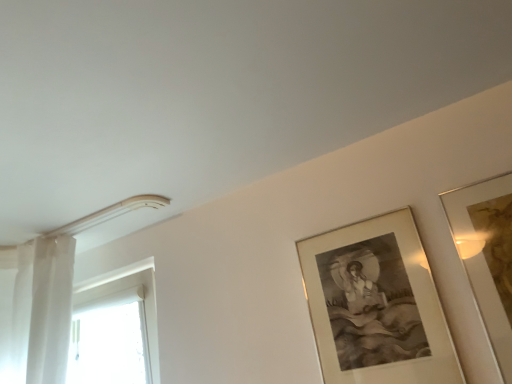
Question: Considering the relative sizes of gold metallic picture frame at upper right, which appears as the 2th picture frame when viewed from the left, and white glossy door at left in the image provided, is gold metallic picture frame at upper right, which appears as the 2th picture frame when viewed from the left, bigger than white glossy door at left?

Choices:
 (A) no
 (B) yes

Answer: (A)

Question: Is gold metallic picture frame at upper right, marked as the 1th picture frame in a right-to-left arrangement, oriented away from white glossy door at left?

Choices:
 (A) yes
 (B) no

Answer: (B)

Question: From a real-world perspective, is gold metallic picture frame at upper right, which appears as the 2th picture frame when viewed from the left, on top of white glossy door at left?

Choices:
 (A) yes
 (B) no

Answer: (B)

Question: Is gold metallic picture frame at upper right, which appears as the 2th picture frame when viewed from the left, wider than white glossy door at left?

Choices:
 (A) no
 (B) yes

Answer: (A)

Question: Considering the relative sizes of gold metallic picture frame at upper right, marked as the 1th picture frame in a right-to-left arrangement, and white glossy door at left in the image provided, is gold metallic picture frame at upper right, marked as the 1th picture frame in a right-to-left arrangement, smaller than white glossy door at left?

Choices:
 (A) yes
 (B) no

Answer: (A)

Question: Can you confirm if gold metallic picture frame at upper right, marked as the 1th picture frame in a right-to-left arrangement, is shorter than white glossy door at left?

Choices:
 (A) yes
 (B) no

Answer: (B)

Question: Can you confirm if gold-framed artwork at upper right, arranged as the 2th picture frame when viewed from the right, is shorter than gold metallic picture frame at upper right, marked as the 1th picture frame in a right-to-left arrangement?

Choices:
 (A) no
 (B) yes

Answer: (B)

Question: From a real-world perspective, does gold-framed artwork at upper right, arranged as the 2th picture frame when viewed from the right, sit lower than gold metallic picture frame at upper right, which appears as the 2th picture frame when viewed from the left?

Choices:
 (A) no
 (B) yes

Answer: (A)

Question: Is gold-framed artwork at upper right, the 1th picture frame viewed from the left, facing towards gold metallic picture frame at upper right, which appears as the 2th picture frame when viewed from the left?

Choices:
 (A) yes
 (B) no

Answer: (B)

Question: Considering the relative positions of gold-framed artwork at upper right, the 1th picture frame viewed from the left, and gold metallic picture frame at upper right, which appears as the 2th picture frame when viewed from the left, in the image provided, is gold-framed artwork at upper right, the 1th picture frame viewed from the left, to the right of gold metallic picture frame at upper right, which appears as the 2th picture frame when viewed from the left, from the viewer's perspective?

Choices:
 (A) yes
 (B) no

Answer: (B)

Question: Is gold-framed artwork at upper right, arranged as the 2th picture frame when viewed from the right, taller than gold metallic picture frame at upper right, which appears as the 2th picture frame when viewed from the left?

Choices:
 (A) no
 (B) yes

Answer: (A)

Question: Can you confirm if gold-framed artwork at upper right, the 1th picture frame viewed from the left, is thinner than gold metallic picture frame at upper right, marked as the 1th picture frame in a right-to-left arrangement?

Choices:
 (A) no
 (B) yes

Answer: (A)

Question: Is gold-framed artwork at upper right, the 1th picture frame viewed from the left, located within gold metallic picture frame at upper right, which appears as the 2th picture frame when viewed from the left?

Choices:
 (A) no
 (B) yes

Answer: (A)